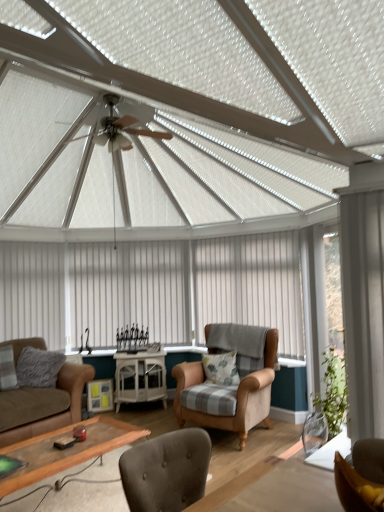
The height and width of the screenshot is (512, 384). In order to click on white glossy cabinet at center in this screenshot , I will do `click(140, 378)`.

At what (x,y) coordinates should I click in order to perform the action: click on tan velvet armchair at center, which is counted as the second chair, starting from the front. Please return your answer as a coordinate pair (x, y). Looking at the image, I should click on (238, 394).

What is the approximate width of white fabric curtain at left, the first curtain from the left?

white fabric curtain at left, the first curtain from the left, is 2.87 inches wide.

Locate an element on the screen. white glossy cabinet at center is located at coordinates coord(140,378).

Is wooden glass coffee table at lower center positioned behind gray fluffy pillow at lower left, which is the 1th pillow from left to right?

No, wooden glass coffee table at lower center is in front of gray fluffy pillow at lower left, which is the 1th pillow from left to right.

Is wooden glass coffee table at lower center touching gray fluffy pillow at lower left, which is the 1th pillow from left to right?

There is a gap between wooden glass coffee table at lower center and gray fluffy pillow at lower left, which is the 1th pillow from left to right.

Is wooden glass coffee table at lower center taller or shorter than gray fluffy pillow at lower left, placed as the second pillow when sorted from right to left?

Considering their sizes, wooden glass coffee table at lower center has less height than gray fluffy pillow at lower left, placed as the second pillow when sorted from right to left.

Which point is more forward, [143,394] or [368,390]?

The point [368,390] is closer.

What's the angular difference between white glossy cabinet at center and white sheer curtain at right, which is the 4th curtain from left to right,'s facing directions?

The angle between the facing direction of white glossy cabinet at center and the facing direction of white sheer curtain at right, which is the 4th curtain from left to right, is 48.4 degrees.

The height and width of the screenshot is (512, 384). I want to click on table below the white sheer curtain at right, which is the 1th curtain in right-to-left order (from a real-world perspective), so click(140, 378).

Which is more to the right, wooden glass coffee table at lower center or white fabric curtain at center, marked as the 3th curtain in a back-to-front arrangement?

From the viewer's perspective, white fabric curtain at center, marked as the 3th curtain in a back-to-front arrangement, appears more on the right side.

Are wooden glass coffee table at lower center and white fabric curtain at center, which is the third curtain from left to right, making contact?

wooden glass coffee table at lower center is not next to white fabric curtain at center, which is the third curtain from left to right, and they're not touching.

Based on the photo, how different are the orientations of wooden glass coffee table at lower center and white fabric curtain at center, the second curtain when ordered from front to back, in degrees?

The angle between the facing direction of wooden glass coffee table at lower center and the facing direction of white fabric curtain at center, the second curtain when ordered from front to back, is 89.7 degrees.

Considering the relative sizes of wooden glass coffee table at lower center and white fabric curtain at center, marked as the 3th curtain in a back-to-front arrangement, in the image provided, is wooden glass coffee table at lower center bigger than white fabric curtain at center, marked as the 3th curtain in a back-to-front arrangement,?

Yes.

Which of these two, white textured curtain at center, the first curtain viewed from the back, or wooden glass coffee table at lower center, stands shorter?

wooden glass coffee table at lower center.

Could you tell me if white textured curtain at center, placed as the second curtain when sorted from left to right, is facing wooden glass coffee table at lower center?

Yes, white textured curtain at center, placed as the second curtain when sorted from left to right, is turned towards wooden glass coffee table at lower center.

Considering the positions of point (91, 243) and point (101, 431), is point (91, 243) closer or farther from the camera than point (101, 431)?

Point (91, 243) is positioned farther from the camera compared to point (101, 431).

The image size is (384, 512). Find the location of `curtain that is the 3rd object above the wooden glass coffee table at lower center (from a real-world perspective)`. curtain that is the 3rd object above the wooden glass coffee table at lower center (from a real-world perspective) is located at coordinates (130, 290).

Is point (53, 351) in front of point (17, 296)?

No, it is not.

Could you tell me if gray fluffy pillow at lower left, which is the 1th pillow from left to right, is turned towards white fabric curtain at left, the 4th curtain positioned from the right?

No, gray fluffy pillow at lower left, which is the 1th pillow from left to right, is not turned towards white fabric curtain at left, the 4th curtain positioned from the right.

Is gray fluffy pillow at lower left, placed as the second pillow when sorted from right to left, bigger than white fabric curtain at left, which is the 2th curtain from back to front?

No.

Is gray fluffy pillow at lower left, which is the 1th pillow from left to right, next to white fabric curtain at left, which is the 2th curtain from back to front?

gray fluffy pillow at lower left, which is the 1th pillow from left to right, and white fabric curtain at left, which is the 2th curtain from back to front, are clearly separated.

Is white fabric curtain at center, the 2th curtain positioned from the right, aimed at white glossy cabinet at center?

Yes, white fabric curtain at center, the 2th curtain positioned from the right, faces towards white glossy cabinet at center.

Can you confirm if white fabric curtain at center, marked as the 3th curtain in a back-to-front arrangement, is positioned to the right of white glossy cabinet at center?

Yes.

In the scene shown: Is white glossy cabinet at center inside white fabric curtain at center, the second curtain when ordered from front to back?

No, white glossy cabinet at center is located outside of white fabric curtain at center, the second curtain when ordered from front to back.

Between point (148, 267) and point (237, 308), which one is positioned in front?

The point (237, 308) is closer.

From the image's perspective, does white textured curtain at center, the first curtain viewed from the back, appear lower than white fabric curtain at center, the second curtain when ordered from front to back?

Correct, white textured curtain at center, the first curtain viewed from the back, appears lower than white fabric curtain at center, the second curtain when ordered from front to back, in the image.

Could you measure the distance between white textured curtain at center, arranged as the third curtain when viewed from the right, and white fabric curtain at center, marked as the 3th curtain in a back-to-front arrangement?

The distance of white textured curtain at center, arranged as the third curtain when viewed from the right, from white fabric curtain at center, marked as the 3th curtain in a back-to-front arrangement, is 33.71 inches.

Is white textured curtain at center, arranged as the third curtain when viewed from the right, wider than white fabric curtain at center, the 2th curtain positioned from the right?

No.

Where is `coffee table that appears on the right of gray fluffy pillow at lower left, which is the 1th pillow from left to right`? The height and width of the screenshot is (512, 384). coffee table that appears on the right of gray fluffy pillow at lower left, which is the 1th pillow from left to right is located at coordinates (66, 450).

Locate an element on the screen. This screenshot has width=384, height=512. the 3rd curtain in front of the white glossy cabinet at center is located at coordinates (363, 308).

Looking at the image, which one is located further to white sheer curtain at right, arranged as the first curtain when viewed from the front, brown fabric chair at lower right, which appears as the 2th chair when viewed from the back, or gray fluffy pillow at lower left, which is the 1th pillow from left to right?

Among the two, gray fluffy pillow at lower left, which is the 1th pillow from left to right, is located further to white sheer curtain at right, arranged as the first curtain when viewed from the front.

Considering their positions, is white textured curtain at center, the first curtain viewed from the back, positioned closer to white fabric curtain at center, the 2th curtain positioned from the right, than tan velvet armchair at center, the 2th chair when ordered from top to bottom?

white textured curtain at center, the first curtain viewed from the back.

When comparing their distances from fluffy gray pillow at center, the first pillow positioned from the right, does white textured curtain at center, marked as the 4th curtain in a front-to-back arrangement, or white sheer curtain at right, which is the 4th curtain from back to front, seem closer?

Answer: white textured curtain at center, marked as the 4th curtain in a front-to-back arrangement.

Estimate the real-world distances between objects in this image. Which object is closer to white textured curtain at center, the first curtain viewed from the back, gray fluffy pillow at lower left, which is the 1th pillow from left to right, or white sheer curtain at right, which is the 1th curtain in right-to-left order?

The object closer to white textured curtain at center, the first curtain viewed from the back, is gray fluffy pillow at lower left, which is the 1th pillow from left to right.

Looking at the image, which one is located closer to brown leather couch at lower left, white fabric curtain at left, the 4th curtain positioned from the right, or fluffy gray pillow at center, the 2th pillow in the left-to-right sequence?

Based on the image, white fabric curtain at left, the 4th curtain positioned from the right, appears to be nearer to brown leather couch at lower left.

Considering their positions, is brown leather couch at lower left positioned closer to gray fluffy pillow at lower left, placed as the second pillow when sorted from right to left, than white fabric curtain at left, which is the 2th curtain from back to front?

The object closer to gray fluffy pillow at lower left, placed as the second pillow when sorted from right to left, is brown leather couch at lower left.

When comparing their distances from white fabric curtain at center, which is the third curtain from left to right, does fluffy gray pillow at center, the first pillow positioned from the right, or white sheer curtain at right, arranged as the first curtain when viewed from the front, seem further?

white sheer curtain at right, arranged as the first curtain when viewed from the front, is further to white fabric curtain at center, which is the third curtain from left to right.

Based on their spatial positions, is white fabric curtain at left, placed as the third curtain when sorted from front to back, or white sheer curtain at right, which is the 4th curtain from back to front, further from brown fabric chair at lower right, which is the 2th chair from bottom to top?

white fabric curtain at left, placed as the third curtain when sorted from front to back, is positioned further to the anchor brown fabric chair at lower right, which is the 2th chair from bottom to top.

Find the location of `coffee table between brown leather couch at lower left and fluffy gray pillow at center, the 2th pillow in the left-to-right sequence, from left to right`. coffee table between brown leather couch at lower left and fluffy gray pillow at center, the 2th pillow in the left-to-right sequence, from left to right is located at coordinates (66, 450).

Locate an element on the screen. curtain positioned between brown fabric chair at lower right, positioned as the 1th chair in front-to-back order, and fluffy gray pillow at center, the first pillow positioned from the right, from near to far is located at coordinates (363, 308).

Find the location of a particular element. This screenshot has height=512, width=384. table between white textured curtain at center, the first curtain viewed from the back, and fluffy gray pillow at center, the first pillow positioned from the right is located at coordinates (140, 378).

You are a GUI agent. You are given a task and a screenshot of the screen. Output one action in this format:
    pyautogui.click(x=<x>, y=<y>)
    Task: Click on the chair between white sheer curtain at right, which is the 4th curtain from back to front, and white textured curtain at center, the first curtain viewed from the back, along the z-axis
    Image resolution: width=384 pixels, height=512 pixels.
    Given the screenshot: What is the action you would take?
    pyautogui.click(x=238, y=394)